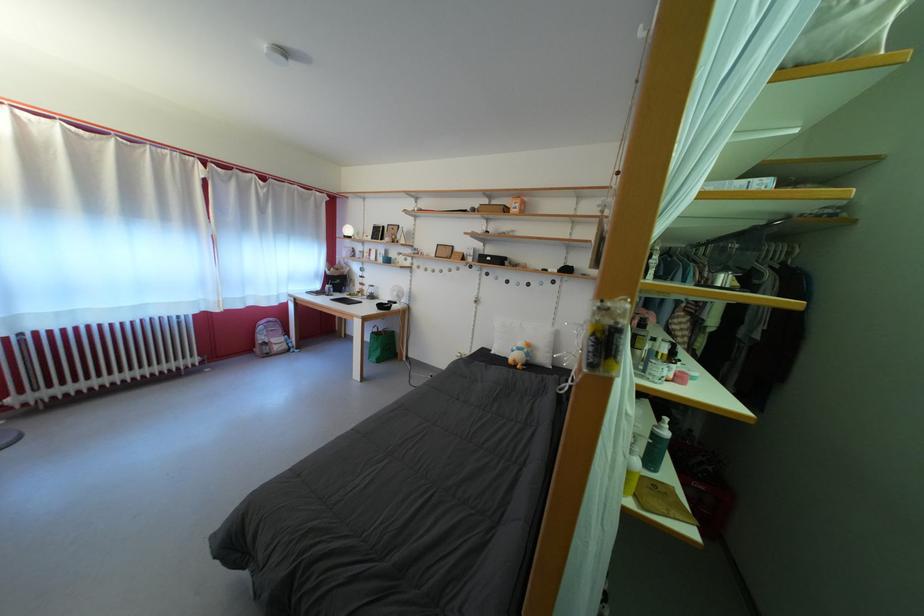
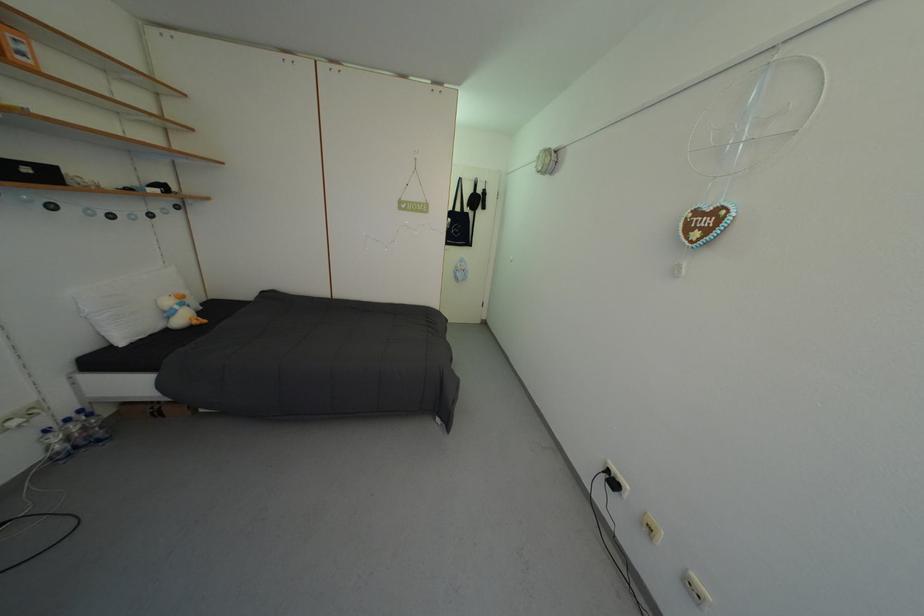
Find the pixel in the second image that matches (x=537, y=352) in the first image.

(190, 302)